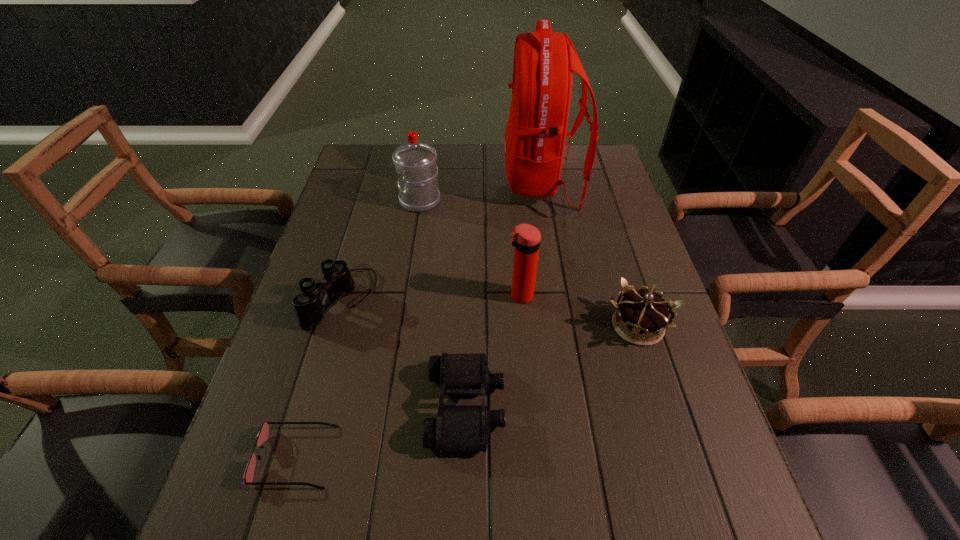
Identify the location of free space between the taller binoculars and the shortest object. The height and width of the screenshot is (540, 960). (319, 377).

Locate an element on the screen. free space between the thermos bottle and the third object from left to right is located at coordinates (470, 248).

Find the location of a particular element. free spot between the sunglasses and the fourth object from left to right is located at coordinates (380, 431).

The width and height of the screenshot is (960, 540). What are the coordinates of `blank region between the crown and the backpack` in the screenshot? It's located at (589, 254).

Where is `free area in between the taller binoculars and the tallest object`? The width and height of the screenshot is (960, 540). free area in between the taller binoculars and the tallest object is located at coordinates (442, 240).

What are the coordinates of `free space between the water bottle and the second shortest object` in the screenshot? It's located at (443, 303).

Locate an element on the screen. vacant area that lies between the water bottle and the second shortest object is located at coordinates (443, 303).

You are a GUI agent. You are given a task and a screenshot of the screen. Output one action in this format:
    pyautogui.click(x=<x>, y=<y>)
    Task: Click on the free space between the tallest object and the fifth object from right to left
    
    Given the screenshot: What is the action you would take?
    point(481,192)

Find the location of a particular element. This screenshot has width=960, height=540. vacant space that's between the taller binoculars and the crown is located at coordinates (491, 311).

In order to click on vacant region between the shortest object and the fifth object from right to left in this screenshot , I will do `click(357, 329)`.